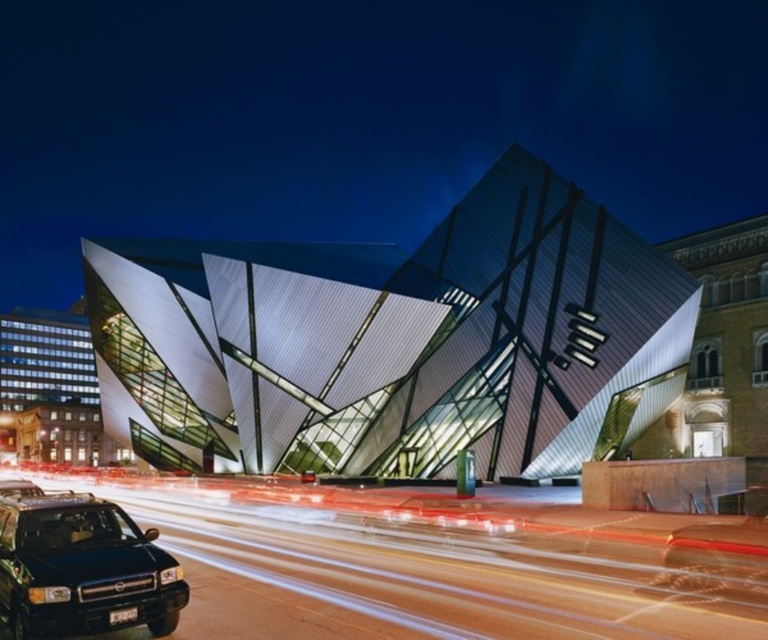
Question: Which of the following is the farthest from the observer?

Choices:
 (A) (35, 564)
 (B) (366, 282)

Answer: (B)

Question: Does polished glass building at center appear under black matte suv at lower left?

Choices:
 (A) yes
 (B) no

Answer: (B)

Question: Which point is farther to the camera?

Choices:
 (A) (144, 259)
 (B) (45, 614)

Answer: (A)

Question: Can you confirm if polished glass building at center is wider than black matte suv at lower left?

Choices:
 (A) yes
 (B) no

Answer: (A)

Question: Does polished glass building at center come in front of black matte suv at lower left?

Choices:
 (A) no
 (B) yes

Answer: (A)